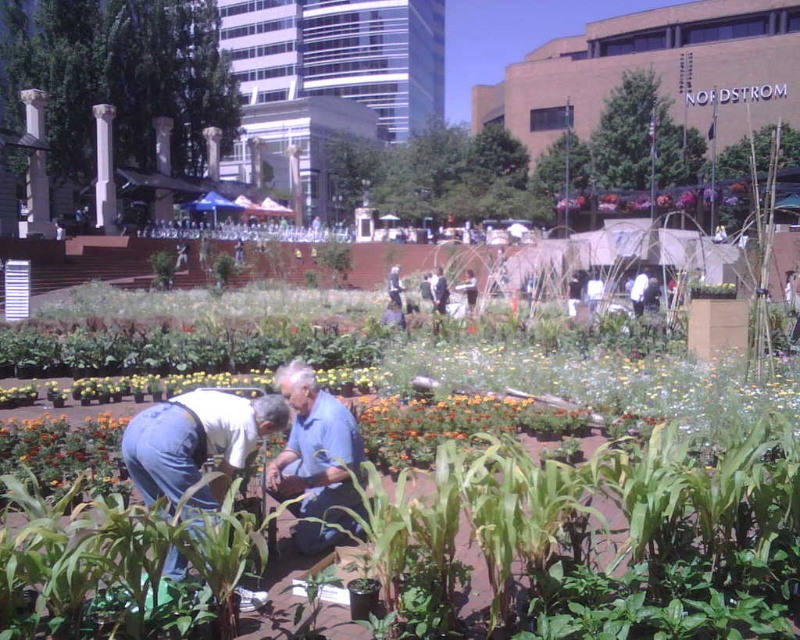
In the scene shown: You are a photographer aiming to capture a detailed shot of the denim jeans at center and the white fabric at center in the urban garden scene. Which object should you focus on first if you want to ensure both are in sharp focus without adjusting the camera settings?

The denim jeans at center is much taller than the white fabric at center, so focusing on the denim jeans at center first will help maintain sharpness for both objects since it is the farther one from the camera.

You are a photographer trying to capture the gardener in the denim jeans at center and the white fabric at center. Which one of these items would appear bigger in your photo?

The denim jeans at center is larger in size than the white fabric at center, so it would appear bigger in the photo.